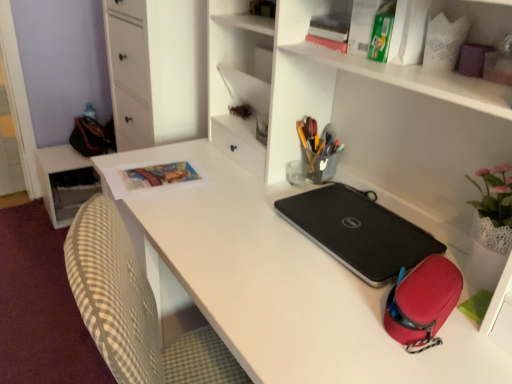
Question: From a real-world perspective, relative to matte paper book at upper left, is white matte file cabinet at upper left vertically above or below?

Choices:
 (A) above
 (B) below

Answer: (A)

Question: From the image's perspective, is white matte file cabinet at upper left located above or below matte paper book at upper left?

Choices:
 (A) below
 (B) above

Answer: (B)

Question: Considering the real-world distances, which object is closest to the white matte file cabinet at upper left?

Choices:
 (A) white glossy table at lower left
 (B) metallic silver pen holder at center
 (C) white matte desk at center
 (D) black textured laptop at center
 (E) matte paper book at upper left

Answer: (E)

Question: Which of these objects is positioned farthest from the metallic silver pen holder at center?

Choices:
 (A) black textured laptop at center
 (B) white matte desk at center
 (C) matte paper book at upper left
 (D) white glossy table at lower left
 (E) white matte file cabinet at upper left

Answer: (D)